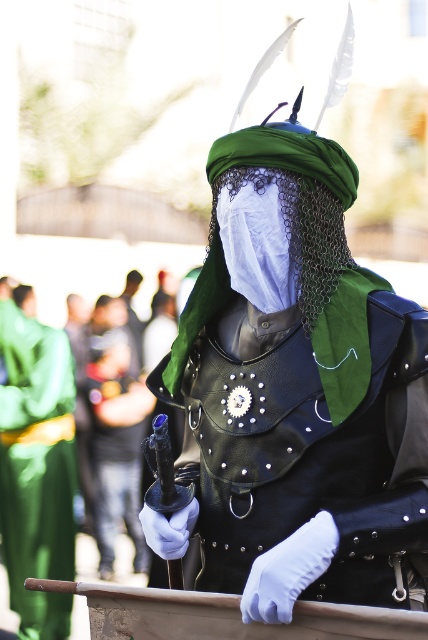
In the scene shown: Which is more to the left, leather armor at center or green leather robe at left?

green leather robe at left

Measure the distance between point (x=284, y=323) and camera.

Point (x=284, y=323) and camera are 24.07 feet apart.

This screenshot has width=428, height=640. Identify the location of leather armor at center. (296, 385).